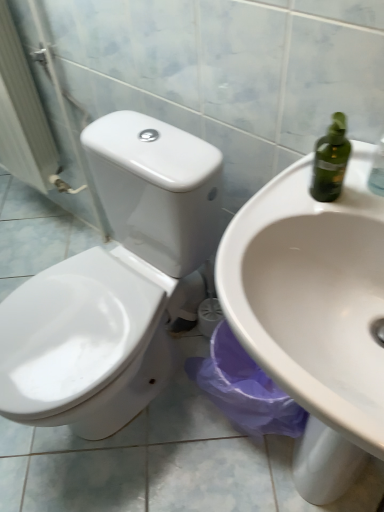
Question: Does white glossy toilet at left turn towards white glossy sink at center?

Choices:
 (A) no
 (B) yes

Answer: (A)

Question: Is white glossy toilet at left positioned with its back to white glossy sink at center?

Choices:
 (A) yes
 (B) no

Answer: (B)

Question: Does white glossy toilet at left have a lesser width compared to white glossy sink at center?

Choices:
 (A) no
 (B) yes

Answer: (B)

Question: From the image's perspective, is white glossy toilet at left located above white glossy sink at center?

Choices:
 (A) yes
 (B) no

Answer: (A)

Question: From a real-world perspective, is white glossy toilet at left positioned under white glossy sink at center based on gravity?

Choices:
 (A) no
 (B) yes

Answer: (A)

Question: Is white glossy toilet at left taller than white glossy sink at center?

Choices:
 (A) no
 (B) yes

Answer: (B)

Question: From a real-world perspective, is white glossy sink at center on top of white glossy toilet at center?

Choices:
 (A) no
 (B) yes

Answer: (B)

Question: From a real-world perspective, is white glossy sink at center positioned under white glossy toilet at center based on gravity?

Choices:
 (A) yes
 (B) no

Answer: (B)

Question: Is white glossy sink at center in front of white glossy toilet at center?

Choices:
 (A) no
 (B) yes

Answer: (B)

Question: Does white glossy sink at center have a greater height compared to white glossy toilet at center?

Choices:
 (A) yes
 (B) no

Answer: (A)

Question: Is white glossy sink at center positioned with its back to white glossy toilet at center?

Choices:
 (A) yes
 (B) no

Answer: (B)

Question: Is white glossy sink at center located outside white glossy toilet at center?

Choices:
 (A) no
 (B) yes

Answer: (B)

Question: Can you confirm if white glossy toilet at center is thinner than white glossy toilet at left?

Choices:
 (A) no
 (B) yes

Answer: (A)